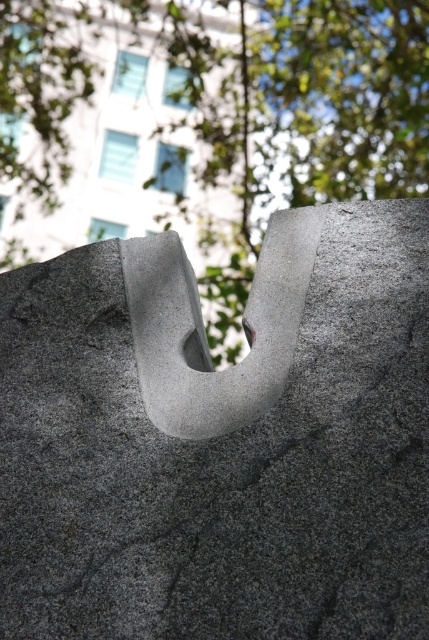
Does gray granite stone at center have a lesser width compared to green leafy tree at upper center?

Yes, gray granite stone at center is thinner than green leafy tree at upper center.

Does gray granite stone at center have a greater width compared to green leafy tree at upper center?

No.

You are a GUI agent. You are given a task and a screenshot of the screen. Output one action in this format:
    pyautogui.click(x=<x>, y=<y>)
    Task: Click on the gray granite stone at center
    This screenshot has height=640, width=429.
    Given the screenshot: What is the action you would take?
    pyautogui.click(x=220, y=440)